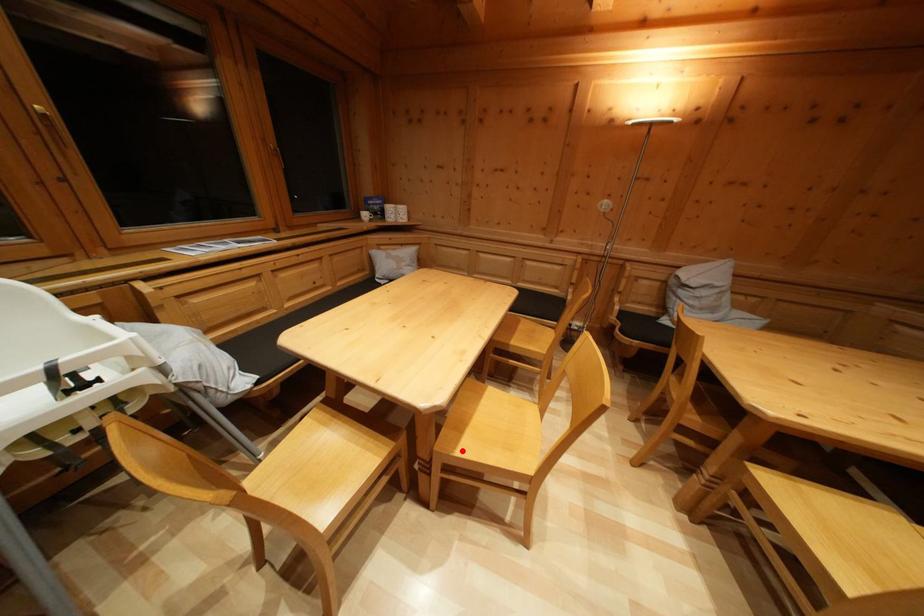
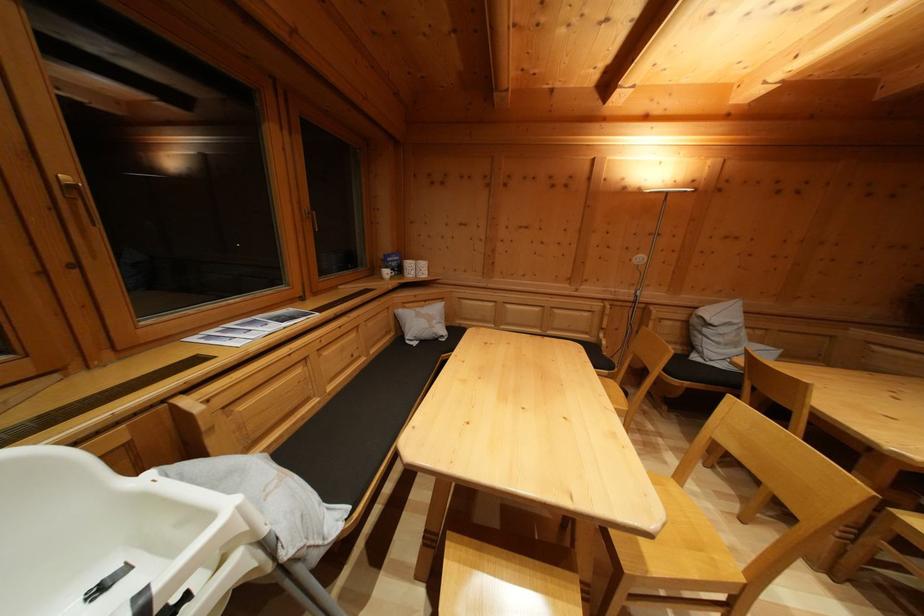
In the second image, find the point that corresponds to the highlighted location in the first image.

(647, 564)